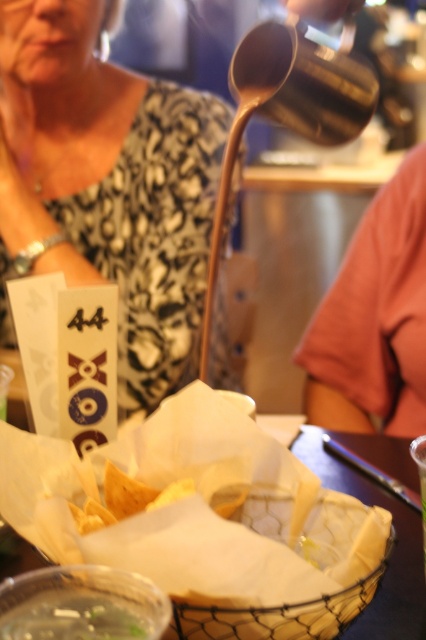
Does matte black shirt at upper left have a larger size compared to green translucent liquid at lower left?

Indeed, matte black shirt at upper left has a larger size compared to green translucent liquid at lower left.

Is matte black shirt at upper left closer to the viewer compared to green translucent liquid at lower left?

No, it is not.

Which is behind, point (172, 182) or point (74, 636)?

Positioned behind is point (172, 182).

Identify the location of matte black shirt at upper left. (108, 186).